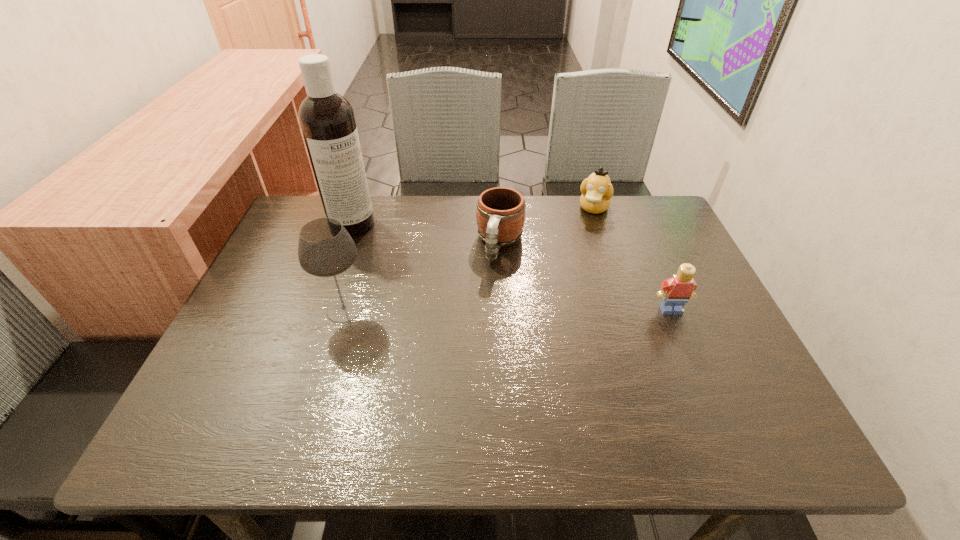
At what (x,y) coordinates should I click in order to perform the action: click on object at the right edge. Please return your answer as a coordinate pair (x, y). The width and height of the screenshot is (960, 540). Looking at the image, I should click on (675, 292).

At what (x,y) coordinates should I click in order to perform the action: click on object that is at the far left corner. Please return your answer as a coordinate pair (x, y). Looking at the image, I should click on (327, 120).

You are a GUI agent. You are given a task and a screenshot of the screen. Output one action in this format:
    pyautogui.click(x=<x>, y=<y>)
    Task: Click on the free space at the far edge of the desktop
    
    Given the screenshot: What is the action you would take?
    pyautogui.click(x=547, y=231)

Identify the location of vacant region at the near edge. (521, 404).

In the image, there is a desktop. In order to click on vacant space at the left edge in this screenshot , I will do `click(237, 335)`.

Image resolution: width=960 pixels, height=540 pixels. Find the location of `free space at the far right corner of the desktop`. free space at the far right corner of the desktop is located at coordinates (617, 219).

Where is `free point between the tallest object and the second object from right to left`? The width and height of the screenshot is (960, 540). free point between the tallest object and the second object from right to left is located at coordinates (473, 216).

Find the location of `vacant space that's between the wineglass and the duckling`. vacant space that's between the wineglass and the duckling is located at coordinates (469, 259).

This screenshot has width=960, height=540. What are the coordinates of `vacant space that is in between the mug and the duckling` in the screenshot? It's located at (547, 226).

This screenshot has width=960, height=540. In order to click on vacant area that lies between the mug and the rightmost object in this screenshot , I will do `click(586, 276)`.